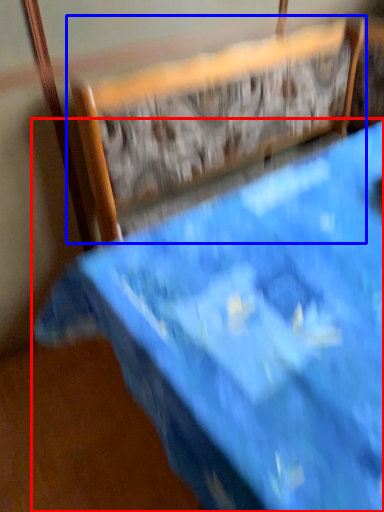
Question: Among these objects, which one is farthest to the camera, furniture (highlighted by a red box) or chair (highlighted by a blue box)?

Choices:
 (A) furniture
 (B) chair

Answer: (B)